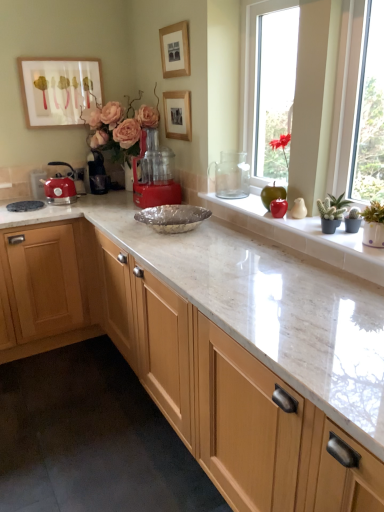
Question: Considering the positions of red matte flower at upper right, which appears as the first plant when viewed from the back, and red plastic food processor at center, arranged as the second coffee machine when viewed from the left, in the image, is red matte flower at upper right, which appears as the first plant when viewed from the back, wider or thinner than red plastic food processor at center, arranged as the second coffee machine when viewed from the left,?

Choices:
 (A) wide
 (B) thin

Answer: (B)

Question: Is red matte flower at upper right, placed as the second plant when sorted from front to back, to the left or to the right of red plastic food processor at center, the 1th coffee machine viewed from the right, in the image?

Choices:
 (A) right
 (B) left

Answer: (A)

Question: Estimate the real-world distances between objects in this image. Which object is farther from the wooden picture frame at upper center, positioned as the third picture frame in left-to-right order?

Choices:
 (A) red plastic food processor at center, the 1th coffee machine viewed from the right
 (B) wooden picture frame at upper center, acting as the 2th picture frame starting from the right
 (C) matte red kettle at left
 (D) clear glass vase at center
 (E) green succulent at right, the second plant in the top-to-bottom sequence

Answer: (E)

Question: Estimate the real-world distances between objects in this image. Which object is closer to the matte white picture frame at upper left, which is the first picture frame in left-to-right order?

Choices:
 (A) green succulent at right, positioned as the 1th plant in right-to-left order
 (B) red matte flower at upper right, which ranks as the second plant in right-to-left order
 (C) wooden picture frame at upper center, the first picture frame in the right-to-left sequence
 (D) red plastic food processor at center, which is the second coffee machine from back to front
 (E) wooden picture frame at upper center, acting as the 2th picture frame starting from the right

Answer: (C)